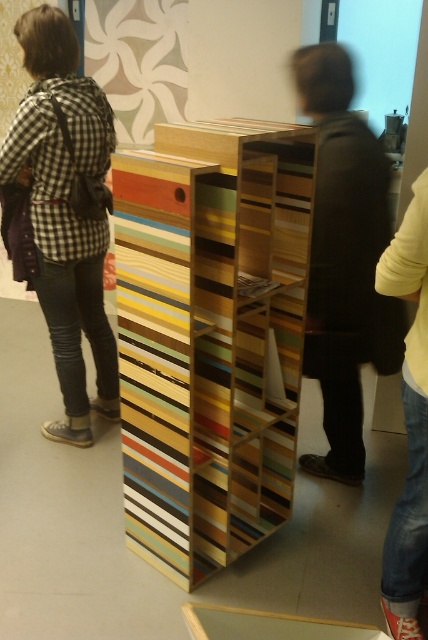
Can you confirm if checkered fabric shirt at left is smaller than dark brown leather jacket at center?

No.

Is point (62, 129) positioned in front of point (360, 429)?

Yes, it is.

The height and width of the screenshot is (640, 428). I want to click on checkered fabric shirt at left, so click(x=65, y=211).

Image resolution: width=428 pixels, height=640 pixels. What are the coordinates of `checkered fabric shirt at left` in the screenshot? It's located at (65, 211).

Is point (83, 227) behind point (422, 212)?

Yes, point (83, 227) is farther from viewer.

What do you see at coordinates (65, 211) in the screenshot?
I see `checkered fabric shirt at left` at bounding box center [65, 211].

Locate an element on the screen. Image resolution: width=428 pixels, height=640 pixels. checkered fabric shirt at left is located at coordinates (65, 211).

Is wooden striped bookshelf at center to the right of dark brown leather jacket at center from the viewer's perspective?

No, wooden striped bookshelf at center is not to the right of dark brown leather jacket at center.

Can you confirm if wooden striped bookshelf at center is positioned above dark brown leather jacket at center?

Actually, wooden striped bookshelf at center is below dark brown leather jacket at center.

Locate an element on the screen. The width and height of the screenshot is (428, 640). wooden striped bookshelf at center is located at coordinates click(211, 337).

The height and width of the screenshot is (640, 428). I want to click on wooden striped bookshelf at center, so point(211,337).